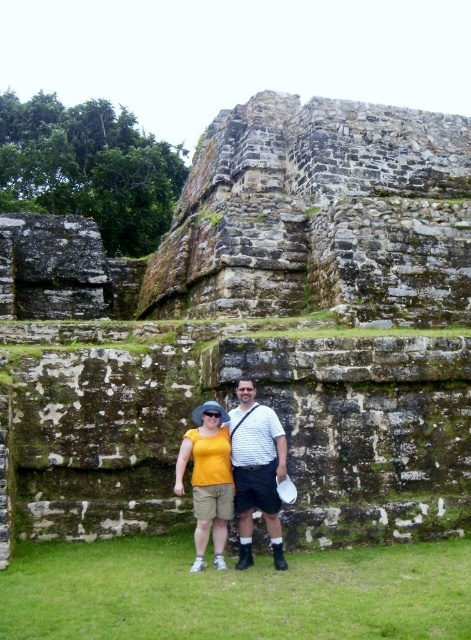
Which of these two, white striped shirt at center or yellow matte shirt at center, stands shorter?

white striped shirt at center

Can you confirm if white striped shirt at center is thinner than yellow matte shirt at center?

Yes.

Find the location of a particular element. The image size is (471, 640). white striped shirt at center is located at coordinates (257, 470).

I want to click on white striped shirt at center, so click(257, 470).